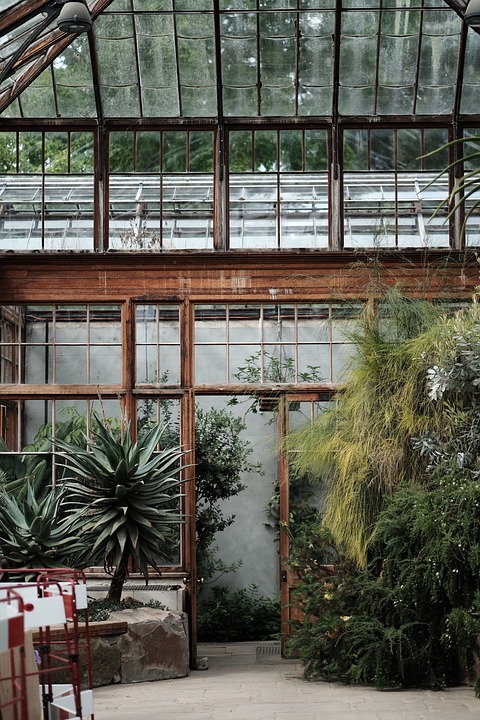
At what (x,y) coordinates should I click in order to perform the action: click on floor. Please return your answer as a coordinate pair (x, y). Looking at the image, I should click on (246, 672), (170, 708), (344, 716).